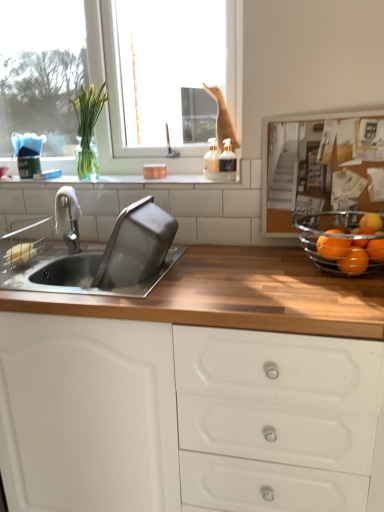
What is the approximate width of orange matte at right, the fourth orange viewed from the right?

The width of orange matte at right, the fourth orange viewed from the right, is 3.47 inches.

This screenshot has width=384, height=512. I want to click on green glass vase at upper left, so click(x=88, y=128).

At what (x,y) coordinates should I click in order to perform the action: click on stainless steel sink at left. Please return your answer as a coordinate pair (x, y). Image resolution: width=384 pixels, height=512 pixels. Looking at the image, I should click on (95, 254).

Describe the element at coordinates (354, 261) in the screenshot. This screenshot has width=384, height=512. I see `orange matte/orange at right, which is the 2th orange from left to right` at that location.

I want to click on orange matte/orange at right, which is the 2th orange from left to right, so click(354, 261).

Locate an element on the screen. orange matte at right, the 4th orange from the left is located at coordinates (371, 221).

Which of these two, clear glass bowl at right or orange matte at right, the fourth orange viewed from the right, stands shorter?

With less height is orange matte at right, the fourth orange viewed from the right.

Considering the positions of objects clear glass bowl at right and orange matte at right, which ranks as the 1th orange in left-to-right order, in the image provided, who is in front, clear glass bowl at right or orange matte at right, which ranks as the 1th orange in left-to-right order,?

clear glass bowl at right is closer to the camera.

Which is behind, point (327, 218) or point (341, 253)?

Positioned behind is point (327, 218).

Does clear glass bowl at right appear on the left side of orange matte at right, which ranks as the 1th orange in left-to-right order?

In fact, clear glass bowl at right is to the right of orange matte at right, which ranks as the 1th orange in left-to-right order.

From the picture: How distant is clear glass window at upper left from orange matte/orange at right, which is the 3th orange in right-to-left order?

clear glass window at upper left is 2.46 meters from orange matte/orange at right, which is the 3th orange in right-to-left order.

Can you confirm if clear glass window at upper left is shorter than orange matte/orange at right, which is the 3th orange in right-to-left order?

Incorrect, the height of clear glass window at upper left does not fall short of that of orange matte/orange at right, which is the 3th orange in right-to-left order.

Locate an element on the screen. The height and width of the screenshot is (512, 384). window located behind the orange matte/orange at right, which is the 2th orange from left to right is located at coordinates (124, 77).

Based on their sizes in the image, would you say clear glass window at upper left is bigger or smaller than orange matte/orange at right, which is the 3th orange in right-to-left order?

Considering their sizes, clear glass window at upper left takes up more space than orange matte/orange at right, which is the 3th orange in right-to-left order.

Where is `orange that appears below the orange matte at right, the fourth orange viewed from the right (from a real-world perspective)`? The width and height of the screenshot is (384, 512). orange that appears below the orange matte at right, the fourth orange viewed from the right (from a real-world perspective) is located at coordinates (354, 261).

Does orange matte/orange at right, which is the 2th orange from left to right, turn towards orange matte at right, the fourth orange viewed from the right?

No, orange matte/orange at right, which is the 2th orange from left to right, is not turned towards orange matte at right, the fourth orange viewed from the right.

Who is taller, orange matte/orange at right, which is the 2th orange from left to right, or orange matte at right, which ranks as the 1th orange in left-to-right order?

With more height is orange matte/orange at right, which is the 2th orange from left to right.

Is orange matte/orange at right, which is the 3th orange in right-to-left order, situated inside orange matte at right, which ranks as the 1th orange in left-to-right order, or outside?

orange matte/orange at right, which is the 3th orange in right-to-left order, is not enclosed by orange matte at right, which ranks as the 1th orange in left-to-right order.

Can you tell me how much clear glass window at upper left and white tile at upper center differ in facing direction?

clear glass window at upper left and white tile at upper center are facing 0.465 degrees away from each other.

Is white tile at upper center inside clear glass window at upper left?

No, white tile at upper center is not surrounded by clear glass window at upper left.

Considering the sizes of clear glass window at upper left and white tile at upper center in the image, is clear glass window at upper left bigger or smaller than white tile at upper center?

clear glass window at upper left is bigger than white tile at upper center.

Consider the image. From a real-world perspective, which is physically below, clear glass window at upper left or white tile at upper center?

white tile at upper center.

Which of these two, white tile at upper center or clear glass window at upper left, is thinner?

clear glass window at upper left is thinner.

Does white tile at upper center contain clear glass window at upper left?

Definitely not — clear glass window at upper left is not inside white tile at upper center.

Does white tile at upper center have a smaller size compared to clear glass window at upper left?

Yes.

Considering the relative positions of orange matte at right, which is the first orange from right to left, and clear glass bowl at right in the image provided, is orange matte at right, which is the first orange from right to left, in front of clear glass bowl at right?

No, orange matte at right, which is the first orange from right to left, is further to the viewer.

From the image's perspective, relative to clear glass bowl at right, is orange matte at right, which is the first orange from right to left, above or below?

From the image's perspective, orange matte at right, which is the first orange from right to left, appears above clear glass bowl at right.

From their relative heights in the image, would you say orange matte at right, which is the first orange from right to left, is taller or shorter than clear glass bowl at right?

Considering their sizes, orange matte at right, which is the first orange from right to left, has less height than clear glass bowl at right.

Could you tell me if orange matte at right, the 4th orange from the left, is facing clear glass bowl at right?

Yes, orange matte at right, the 4th orange from the left, is oriented towards clear glass bowl at right.

From the image's perspective, is stainless steel sink at left on green glass vase at upper left?

No, from the image's perspective, stainless steel sink at left is not over green glass vase at upper left.

Is stainless steel sink at left oriented away from green glass vase at upper left?

No.

Which of these two, stainless steel sink at left or green glass vase at upper left, is wider?

Wider between the two is stainless steel sink at left.

Locate an element on the screen. The image size is (384, 512). plant lying above the stainless steel sink at left (from the image's perspective) is located at coordinates (88, 128).

Locate an element on the screen. The height and width of the screenshot is (512, 384). glass bowl on the right of orange matte at right, the fourth orange viewed from the right is located at coordinates (342, 242).

Locate an element on the screen. The height and width of the screenshot is (512, 384). orange that is the 4th one when counting downward from the clear glass window at upper left (from the image's perspective) is located at coordinates (354, 261).

Estimate the real-world distances between objects in this image. Which object is closer to stainless steel sink at left, satin nickel faucet at left or green glass vase at upper left?

satin nickel faucet at left lies closer to stainless steel sink at left than the other object.

Looking at the image, which one is located closer to orange matte at right, which is the first orange from right to left, wooden cutting board at left or white matte cabinet at center?

Based on the image, white matte cabinet at center appears to be nearer to orange matte at right, which is the first orange from right to left.

From the image, which object appears to be nearer to wooden cutting board at left, orange matte/orange at right, which is the 2th orange from left to right, or orange matte at right, the fourth orange viewed from the right?

Among the two, orange matte at right, the fourth orange viewed from the right, is located nearer to wooden cutting board at left.

Looking at the image, which one is located closer to orange matte at right, which is the 2th orange in right-to-left order, orange matte at right, the fourth orange viewed from the right, or orange matte/orange at right, which is the 3th orange in right-to-left order?

orange matte/orange at right, which is the 3th orange in right-to-left order, is positioned closer to the anchor orange matte at right, which is the 2th orange in right-to-left order.

Which object lies further to the anchor point stainless steel sink at left, white matte cabinet at center or clear glass bowl at right?

Based on the image, clear glass bowl at right appears to be further to stainless steel sink at left.

Considering their positions, is wooden cutting board at left positioned closer to clear glass window at upper left than green glass vase at upper left?

Among the two, green glass vase at upper left is located nearer to clear glass window at upper left.

Which object lies further to the anchor point orange matte at right, which is the first orange from right to left, green glass vase at upper left or white tile at upper center?

green glass vase at upper left is further to orange matte at right, which is the first orange from right to left.

Which object lies nearer to the anchor point orange matte at right, the third orange from the left, green glass vase at upper left or satin nickel faucet at left?

Based on the image, satin nickel faucet at left appears to be nearer to orange matte at right, the third orange from the left.

Locate an element on the screen. cabinetry between stainless steel sink at left and orange matte at right, the fourth orange viewed from the right, from left to right is located at coordinates (185, 417).

You are a GUI agent. You are given a task and a screenshot of the screen. Output one action in this format:
    pyautogui.click(x=<x>, y=<y>)
    Task: Click on the orange located between satin nickel faucet at left and clear glass bowl at right in the left-right direction
    The width and height of the screenshot is (384, 512).
    Given the screenshot: What is the action you would take?
    pyautogui.click(x=332, y=247)

What are the coordinates of `plant located between satin nickel faucet at left and orange matte/orange at right, which is the 2th orange from left to right, in the left-right direction` in the screenshot? It's located at (88, 128).

Image resolution: width=384 pixels, height=512 pixels. Identify the location of sink between wooden cutting board at left and orange matte at right, the 4th orange from the left, from left to right. (95, 254).